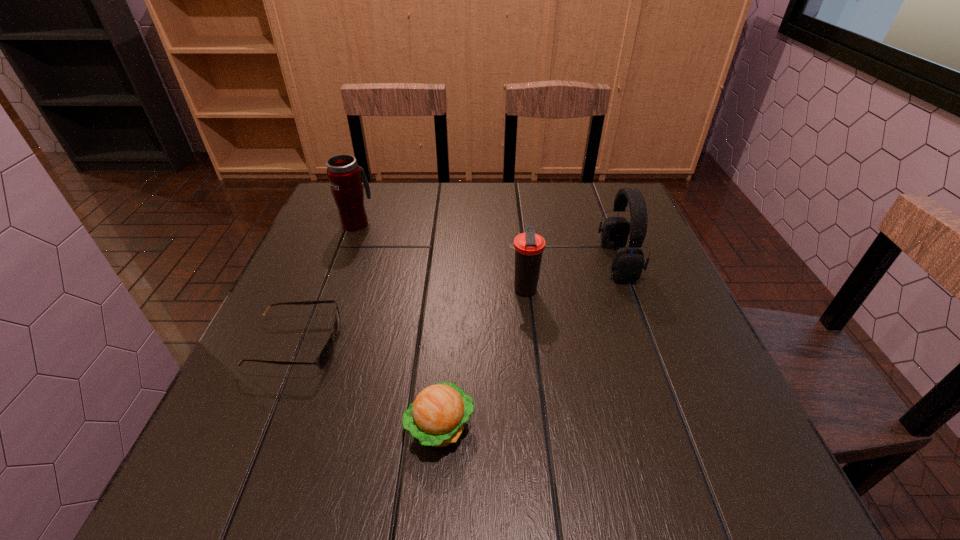
The height and width of the screenshot is (540, 960). I want to click on thermos bottle that is at the left edge, so click(344, 175).

You are a GUI agent. You are given a task and a screenshot of the screen. Output one action in this format:
    pyautogui.click(x=<x>, y=<y>)
    Task: Click on the sunglasses present at the left edge
    Image resolution: width=960 pixels, height=540 pixels.
    Given the screenshot: What is the action you would take?
    pyautogui.click(x=324, y=357)

Locate an element on the screen. The image size is (960, 540). object present at the right edge is located at coordinates (x=627, y=266).

Where is `object at the far left corner`? object at the far left corner is located at coordinates (344, 175).

In the image, there is a desktop. Where is `vacant area at the far edge`? vacant area at the far edge is located at coordinates (438, 201).

At what (x,y) coordinates should I click in order to perform the action: click on vacant area at the near edge of the desktop. Please return your answer as a coordinate pair (x, y). Looking at the image, I should click on (395, 481).

Locate an element on the screen. vacant space at the left edge of the desktop is located at coordinates (322, 242).

Locate an element on the screen. Image resolution: width=960 pixels, height=540 pixels. free space at the right edge of the desktop is located at coordinates (645, 303).

You are a GUI agent. You are given a task and a screenshot of the screen. Output one action in this format:
    pyautogui.click(x=<x>, y=<y>)
    Task: Click on the free space at the far right corner of the desktop
    
    Given the screenshot: What is the action you would take?
    pyautogui.click(x=588, y=206)

Where is `vacant region between the farthest object and the sunglasses`? The image size is (960, 540). vacant region between the farthest object and the sunglasses is located at coordinates (326, 284).